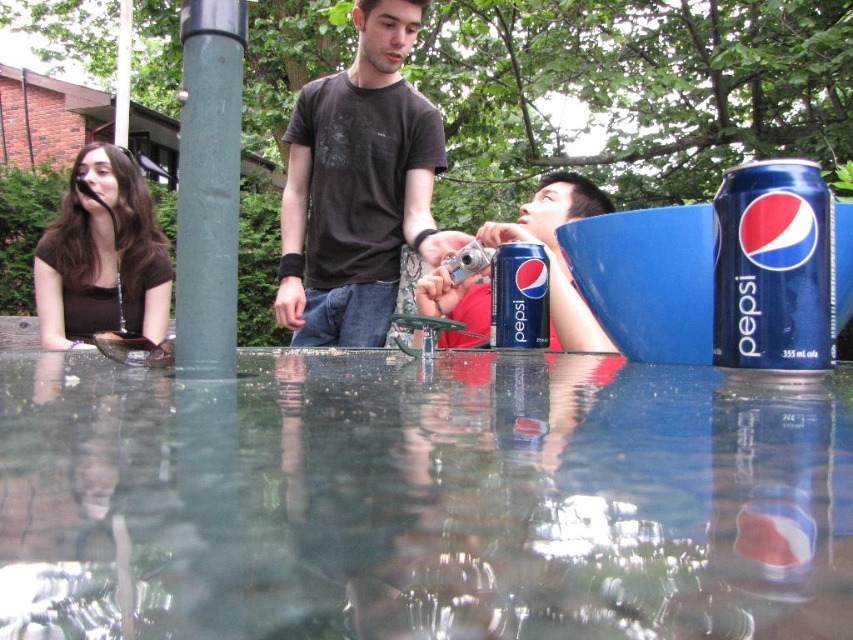
You are standing 20 inches away from the water fountain. Can you reach the point at coordinates point (x=828, y=308) without moving closer?

The distance of point (x=828, y=308) from viewer is 22.47 inches, so you are currently 20 inches away from the water fountain. Since 22.47 inches is farther than your current distance, you cannot reach the point without moving closer.